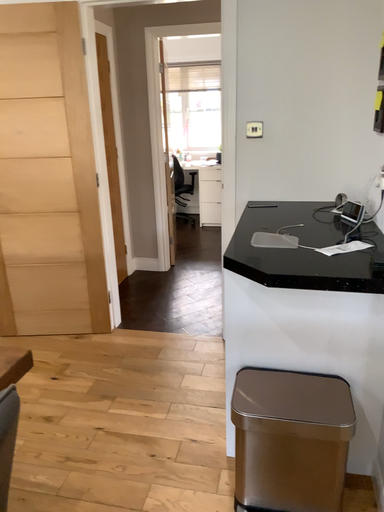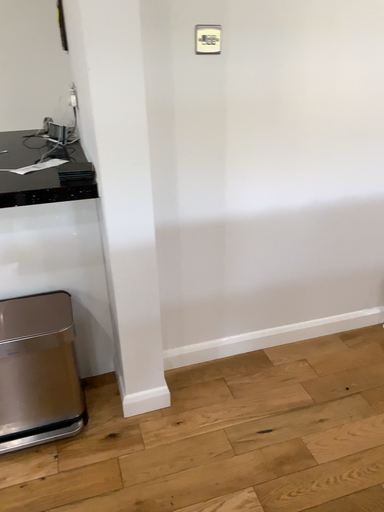
Question: Which way did the camera rotate in the video?

Choices:
 (A) rotated right
 (B) rotated left

Answer: (A)